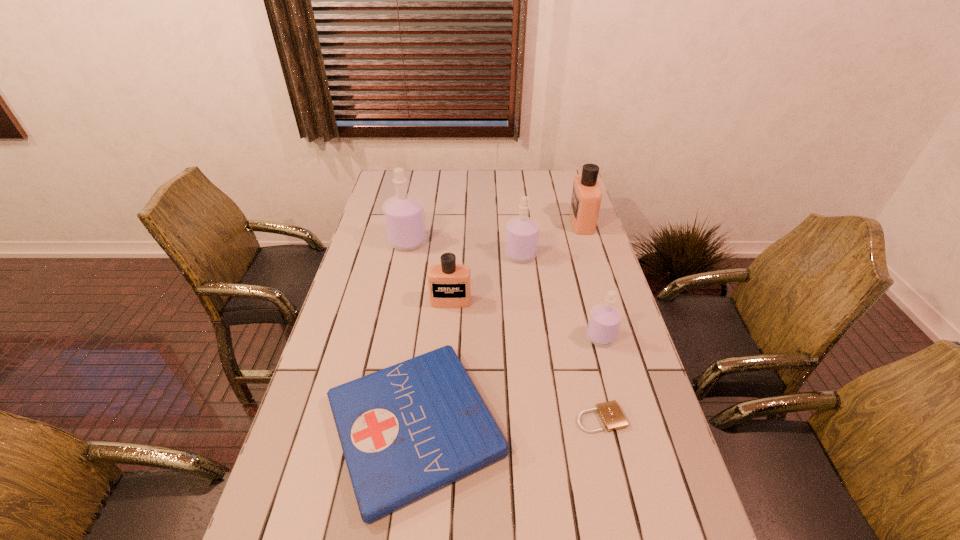
This screenshot has height=540, width=960. Find the location of `perfume that is the fourth nearest to the nearest perfume`. perfume that is the fourth nearest to the nearest perfume is located at coordinates (404, 216).

Locate an element on the screen. purple perfume that is the second closest to the nearest purple perfume is located at coordinates (404, 216).

Where is `purple perfume that is the closest to the leftmost perfume`? The image size is (960, 540). purple perfume that is the closest to the leftmost perfume is located at coordinates (522, 233).